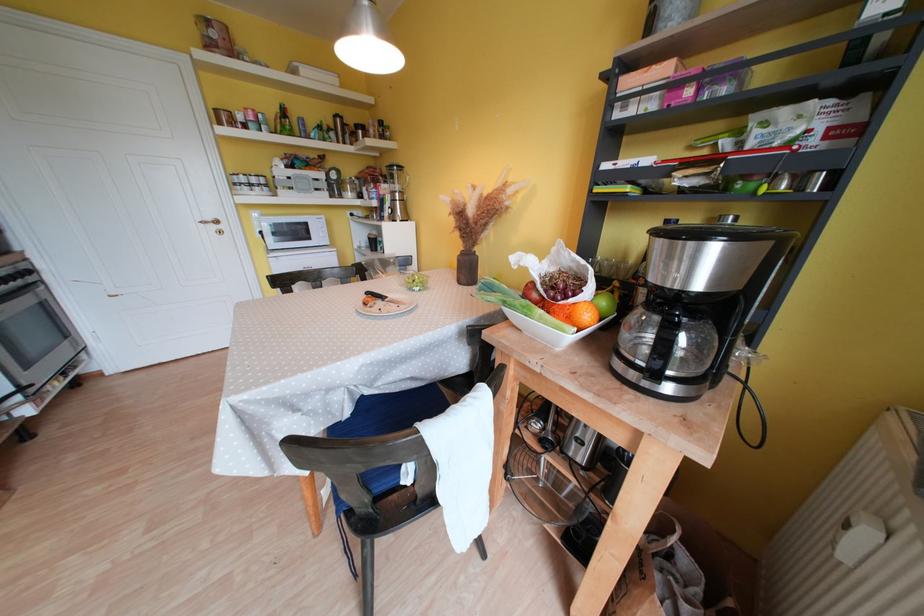
Which object does [467,268] point to?

It corresponds to the dark brown vase in the image.